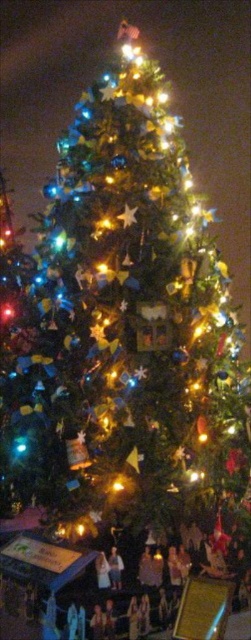
Question: Does white cotton shirt at lower center appear on the left side of metallic gold star at center?

Choices:
 (A) no
 (B) yes

Answer: (B)

Question: Which point is farther to the camera?

Choices:
 (A) metallic gold star at center
 (B) white cotton shirt at lower center

Answer: (A)

Question: Does white cotton shirt at lower center appear under metallic gold star at center?

Choices:
 (A) no
 (B) yes

Answer: (B)

Question: Does white cotton shirt at lower center lie behind metallic gold star at center?

Choices:
 (A) no
 (B) yes

Answer: (A)